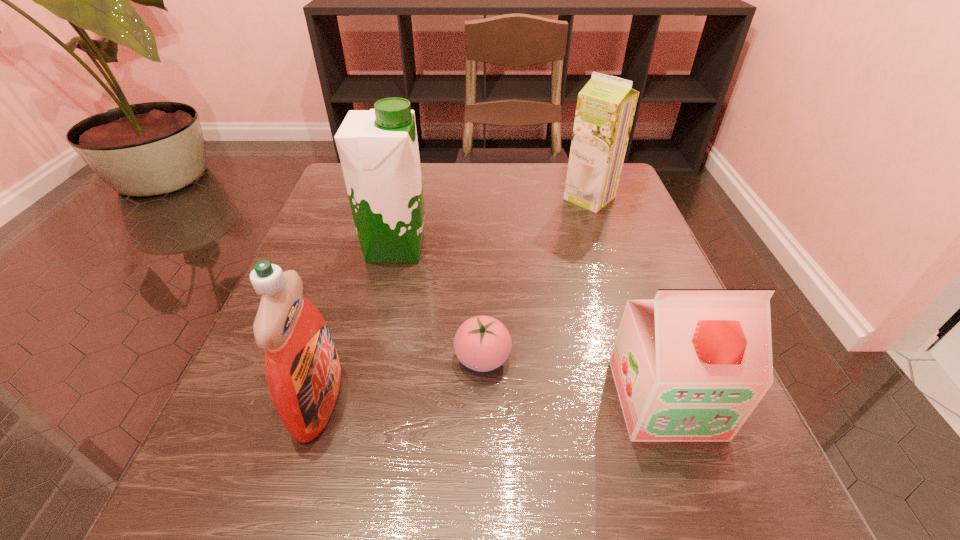
In the image, there is a desktop. Find the location of `free region at the right edge`. free region at the right edge is located at coordinates coord(595,253).

Identify the location of free space at the far right corner of the desktop. (580, 211).

Where is `vacant region at the near right corner`? This screenshot has width=960, height=540. vacant region at the near right corner is located at coordinates (707, 521).

This screenshot has height=540, width=960. Identify the location of empty location between the shortest object and the detergent. (400, 379).

Locate an element on the screen. The image size is (960, 540). vacant space that is in between the detergent and the leftmost soya milk is located at coordinates (357, 323).

Image resolution: width=960 pixels, height=540 pixels. I want to click on free space between the third object from right to left and the farthest soya milk, so click(536, 278).

Find the location of a particular element. Image resolution: width=960 pixels, height=540 pixels. free spot between the tomato and the detergent is located at coordinates (400, 379).

Find the location of `free point between the leftmost soya milk and the farthest soya milk`. free point between the leftmost soya milk and the farthest soya milk is located at coordinates (492, 222).

The image size is (960, 540). Identify the location of free space between the third object from right to left and the leftmost soya milk. (439, 303).

This screenshot has height=540, width=960. I want to click on free spot between the shortest soya milk and the tomato, so click(574, 378).